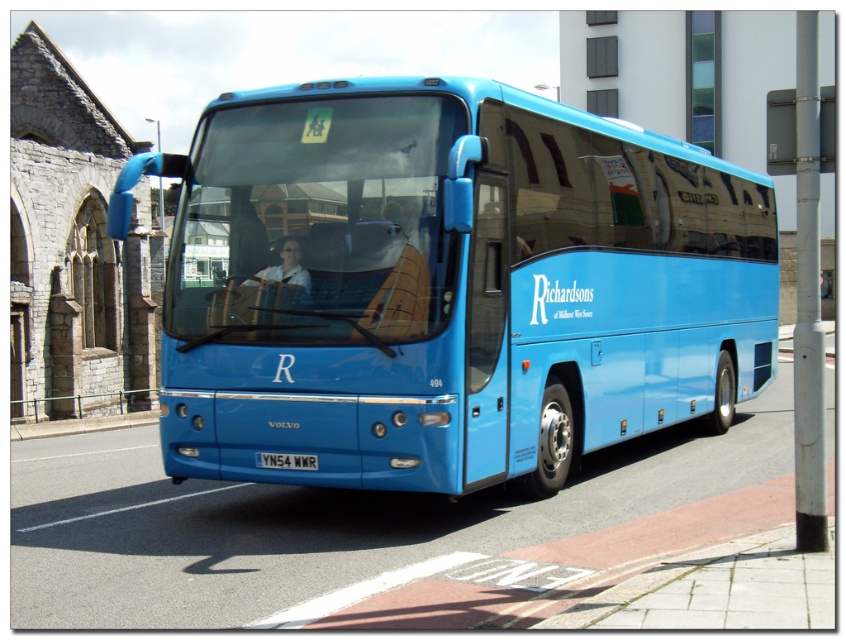
Question: Which point appears closest to the camera in this image?

Choices:
 (A) (288, 266)
 (B) (299, 458)

Answer: (B)

Question: Is blue metallic bus at center positioned in front of white plastic license plate at center?

Choices:
 (A) yes
 (B) no

Answer: (A)

Question: Does blue metallic bus at center have a smaller size compared to white glossy shirt at center?

Choices:
 (A) yes
 (B) no

Answer: (B)

Question: Among these objects, which one is nearest to the camera?

Choices:
 (A) white glossy shirt at center
 (B) white plastic license plate at center
 (C) blue metallic bus at center

Answer: (C)

Question: Is white glossy shirt at center further to camera compared to white plastic license plate at center?

Choices:
 (A) yes
 (B) no

Answer: (A)

Question: Which object is the closest to the white glossy shirt at center?

Choices:
 (A) blue metallic bus at center
 (B) white plastic license plate at center

Answer: (B)